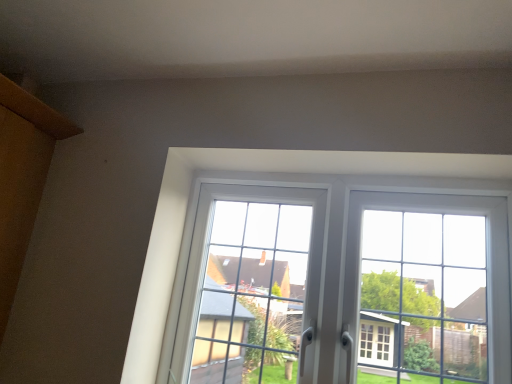
What do you see at coordinates (338, 261) in the screenshot?
I see `white plastic window at center` at bounding box center [338, 261].

Image resolution: width=512 pixels, height=384 pixels. I want to click on white plastic window at center, so click(x=338, y=261).

Locate an element on the screen. The width and height of the screenshot is (512, 384). white plastic window at center is located at coordinates (338, 261).